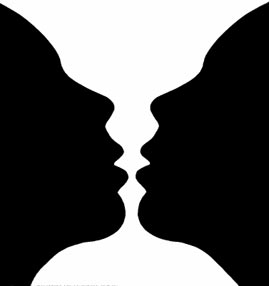
Identify the location of goblet. The height and width of the screenshot is (286, 269). (135, 131).